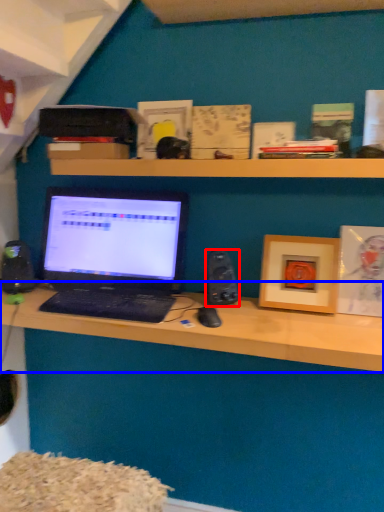
Question: Which object appears closest to the camera in this image, speaker (highlighted by a red box) or desk (highlighted by a blue box)?

Choices:
 (A) speaker
 (B) desk

Answer: (B)